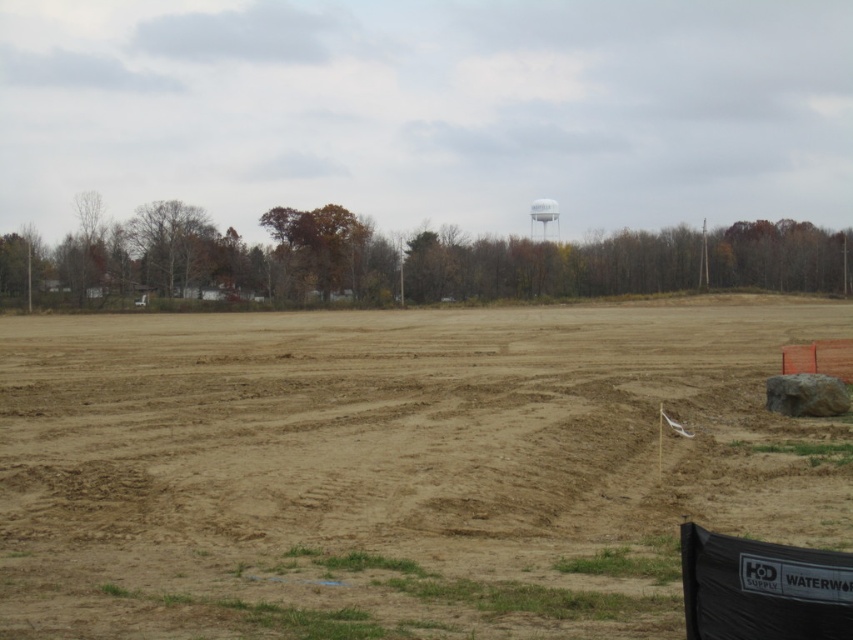
Question: Does brown sandy dirt field at center appear under white matte water tower at upper center?

Choices:
 (A) no
 (B) yes

Answer: (B)

Question: Which point is closer to the camera?

Choices:
 (A) white matte water tower at upper center
 (B) brown sandy dirt field at center

Answer: (B)

Question: Does brown sandy dirt field at center have a greater width compared to white matte water tower at upper center?

Choices:
 (A) no
 (B) yes

Answer: (B)

Question: Which object appears farthest from the camera in this image?

Choices:
 (A) brown sandy dirt field at center
 (B) white matte water tower at upper center

Answer: (B)

Question: Observing the image, what is the correct spatial positioning of brown sandy dirt field at center in reference to white matte water tower at upper center?

Choices:
 (A) left
 (B) right

Answer: (A)